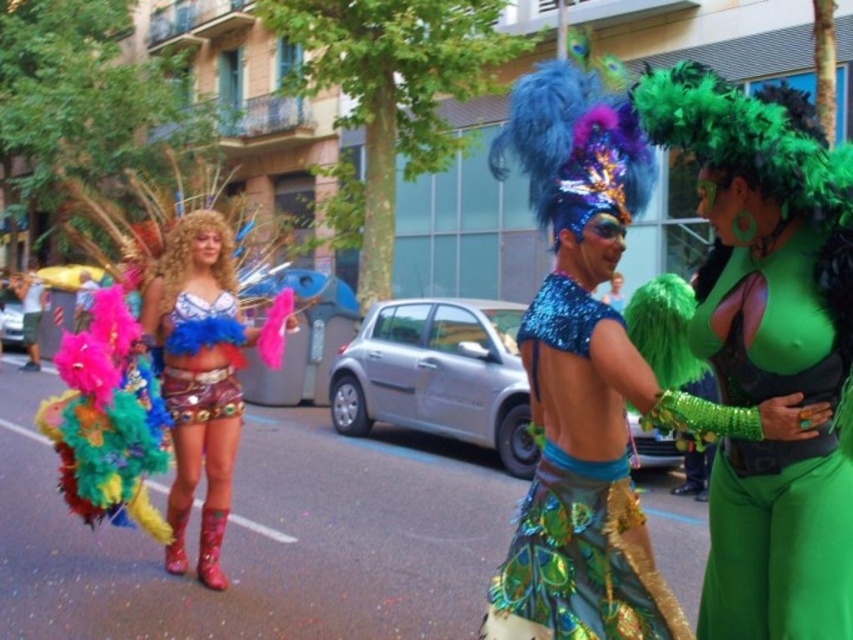
Question: Which of the following is the farthest from the observer?

Choices:
 (A) (231, 480)
 (B) (564, 305)
 (C) (238, 323)

Answer: (A)

Question: Does green sequined top at center have a greater width compared to shiny blue sequins at center?

Choices:
 (A) no
 (B) yes

Answer: (A)

Question: Which point is closer to the camera taking this photo?

Choices:
 (A) (177, 404)
 (B) (808, 285)
 (C) (582, 609)

Answer: (B)

Question: Among these points, which one is nearest to the camera?

Choices:
 (A) (584, 477)
 (B) (218, 528)
 (C) (201, 352)
 (D) (762, 369)

Answer: (D)

Question: From the image, what is the correct spatial relationship of shiny blue sequin headdress at upper right in relation to shiny blue sequins at center?

Choices:
 (A) below
 (B) above

Answer: (B)

Question: Can you confirm if shiny blue sequin headdress at upper right is thinner than shiny blue sequins at center?

Choices:
 (A) no
 (B) yes

Answer: (A)